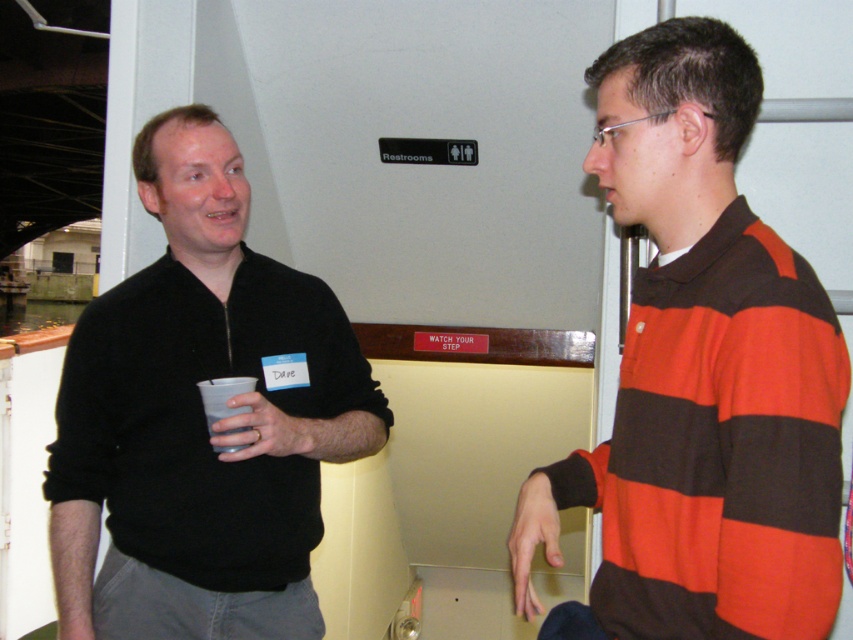
Can you confirm if striped cotton shirt at right is thinner than black matte sweater at center?

Indeed, striped cotton shirt at right has a lesser width compared to black matte sweater at center.

Does striped cotton shirt at right have a lesser height compared to black matte sweater at center?

Yes.

Find the location of a particular element. striped cotton shirt at right is located at coordinates (700, 378).